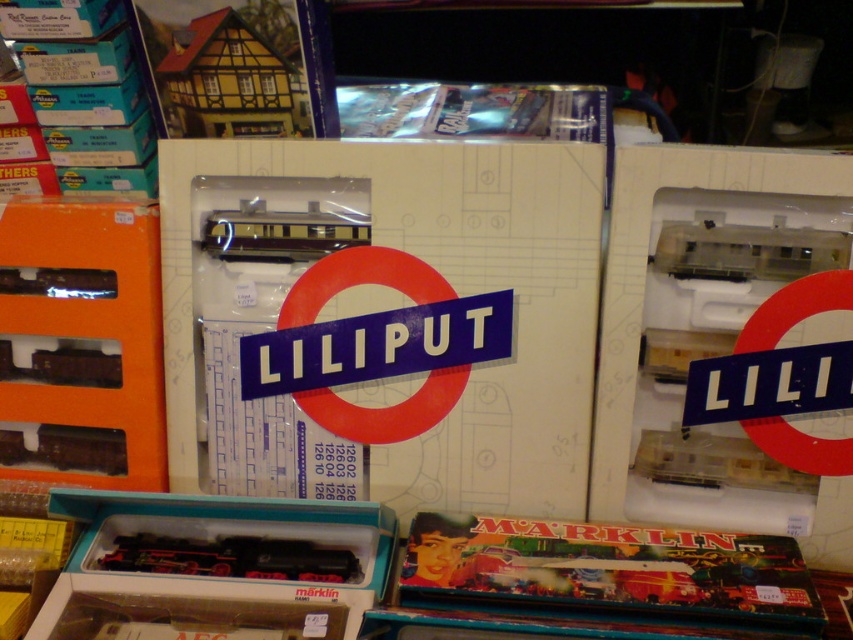
Which is more to the left, white cardboard box at center or yellow wood house at upper left?

yellow wood house at upper left is more to the left.

Does point (467, 232) lie in front of point (213, 116)?

Yes.

Image resolution: width=853 pixels, height=640 pixels. What do you see at coordinates (381, 321) in the screenshot? I see `white cardboard box at center` at bounding box center [381, 321].

Locate an element on the screen. The width and height of the screenshot is (853, 640). white cardboard box at center is located at coordinates coord(381,321).

Does matte black train at lower left have a lesser width compared to shiny black locomotive at lower left?

No.

Image resolution: width=853 pixels, height=640 pixels. What do you see at coordinates (215, 566) in the screenshot? I see `matte black train at lower left` at bounding box center [215, 566].

Which is behind, point (363, 522) or point (268, 560)?

The point (363, 522) is more distant.

At what (x,y) coordinates should I click in order to perform the action: click on matte black train at lower left. Please return your answer as a coordinate pair (x, y). This screenshot has height=640, width=853. Looking at the image, I should click on (215, 566).

I want to click on white cardboard box at center, so click(x=381, y=321).

Who is positioned more to the left, white cardboard box at center or orange matte train set at left?

orange matte train set at left

The width and height of the screenshot is (853, 640). I want to click on white cardboard box at center, so click(381, 321).